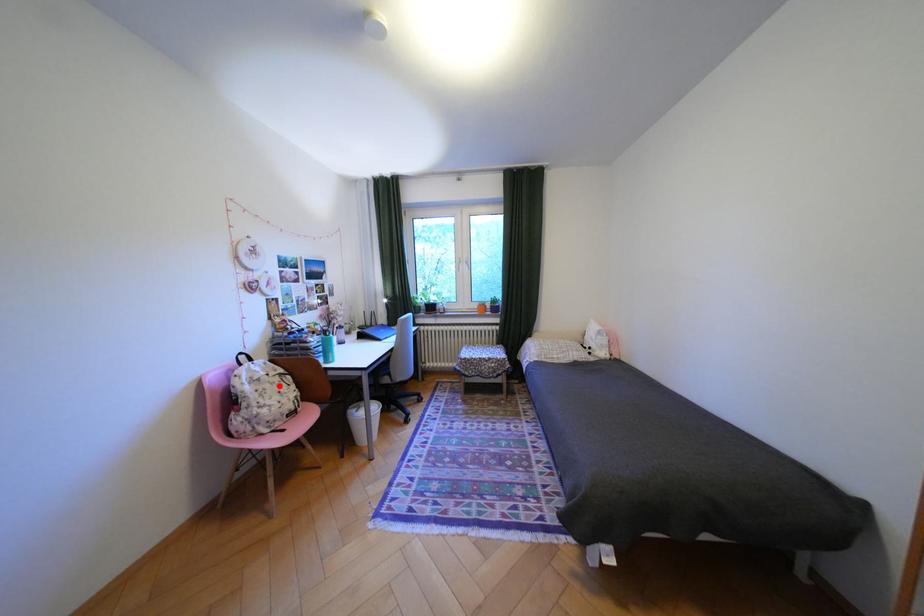
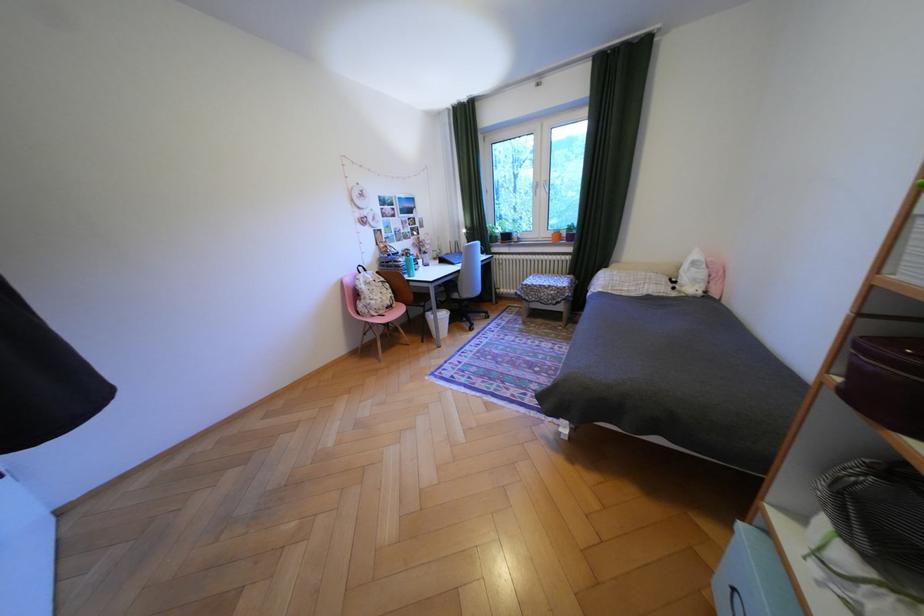
Question: I am providing you with two images of the same scene from different viewpoints. In image1, a red point is highlighted. Considering the same 3D point in image2, which of the following is correct?

Choices:
 (A) It is closer
 (B) It is farther

Answer: (A)